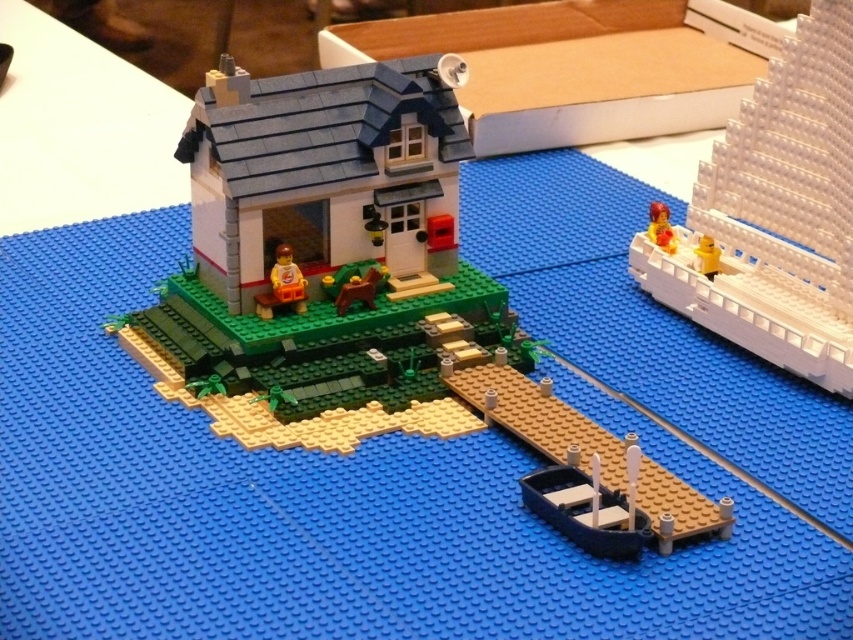
Is point (660, 506) closer to viewer compared to point (668, 216)?

Yes, it is in front of point (668, 216).

Measure the distance between point [671,548] and camera.

Point [671,548] and camera are 3.88 feet apart from each other.

The width and height of the screenshot is (853, 640). What do you see at coordinates (538, 419) in the screenshot?
I see `smooth dark blue boat at lower center` at bounding box center [538, 419].

I want to click on smooth dark blue boat at lower center, so click(x=538, y=419).

Consider the image. How much distance is there between smooth white house at center and smooth dark blue boat at lower center?

smooth white house at center is 6.02 inches away from smooth dark blue boat at lower center.

Find the location of a particular element. Image resolution: width=853 pixels, height=640 pixels. smooth white house at center is located at coordinates (323, 257).

At what (x,y) coordinates should I click in order to perform the action: click on smooth white house at center. Please return your answer as a coordinate pair (x, y). Looking at the image, I should click on (323, 257).

Is point (670, 480) farther from viewer compared to point (706, 241)?

No, (670, 480) is in front of (706, 241).

Is smooth dark blue boat at lower center wider than yellow plastic minifigure at right?

Yes.

What are the coordinates of `smooth dark blue boat at lower center` in the screenshot? It's located at (538, 419).

Locate an element on the screen. smooth dark blue boat at lower center is located at coordinates tap(538, 419).